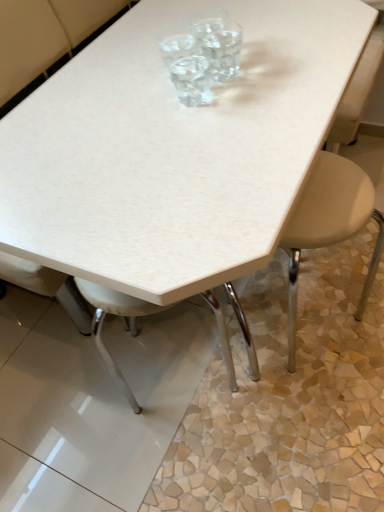
Find the location of a particular element. Image resolution: width=384 pixels, height=512 pixels. free spot to the left of beige plastic chair at lower right is located at coordinates (237, 408).